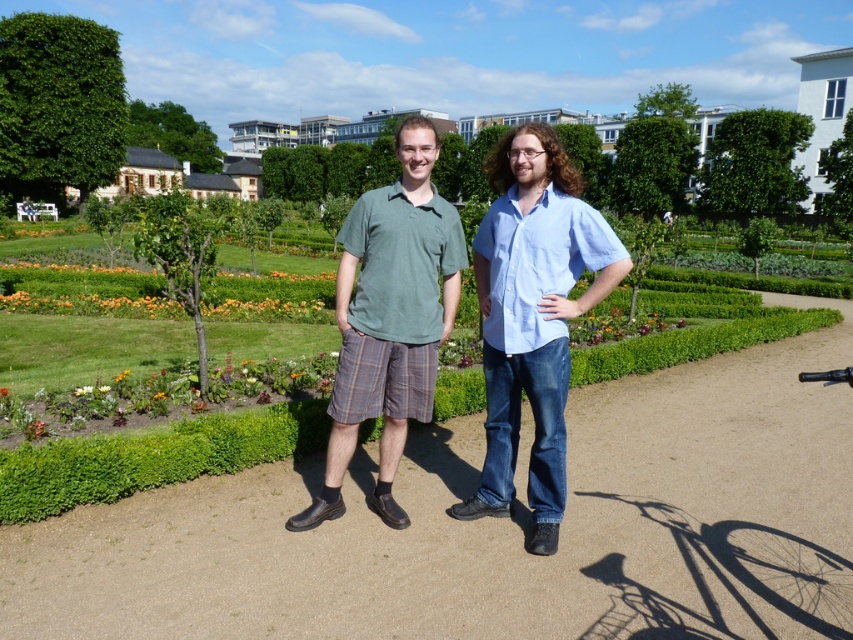
Question: Among these objects, which one is farthest from the camera?

Choices:
 (A) green cotton polo shirt at center
 (B) brown gravel path at center

Answer: (B)

Question: Among these objects, which one is farthest from the camera?

Choices:
 (A) green leafy hedge at upper left
 (B) matte green shirt at center
 (C) green cotton polo shirt at center

Answer: (A)

Question: Is brown gravel path at center closer to camera compared to green leafy hedge at upper left?

Choices:
 (A) yes
 (B) no

Answer: (A)

Question: Which of the following is the farthest from the observer?

Choices:
 (A) pos(437,214)
 (B) pos(61,140)
 (C) pos(430,435)
 (D) pos(595,269)

Answer: (B)

Question: Is brown gravel path at center below matte green shirt at center?

Choices:
 (A) yes
 (B) no

Answer: (A)

Question: Observing the image, what is the correct spatial positioning of green cotton polo shirt at center in reference to green leafy hedge at upper left?

Choices:
 (A) above
 (B) below

Answer: (B)